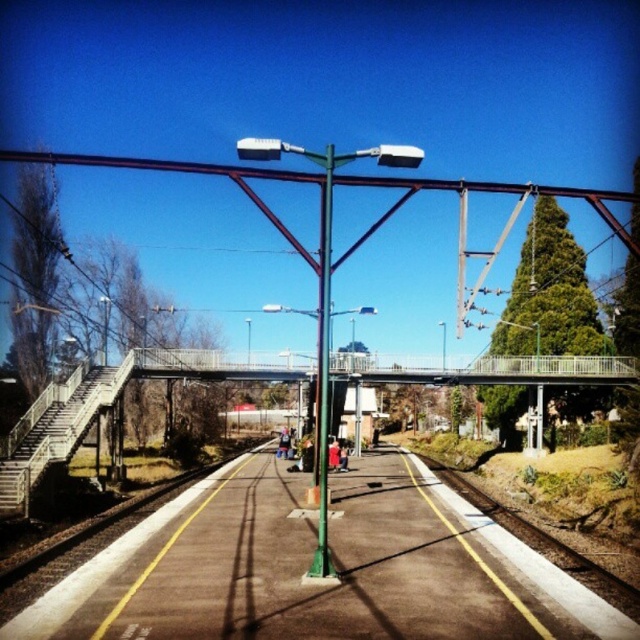
Who is more distant from viewer, (340, 365) or (320, 448)?

The point (340, 365) is behind.

Where is `metallic gray bridge at center`? This screenshot has width=640, height=640. metallic gray bridge at center is located at coordinates (499, 371).

Is metallic gray bridge at center wider than silver metallic train at center?

Correct, the width of metallic gray bridge at center exceeds that of silver metallic train at center.

Is point (150, 358) in front of point (282, 426)?

Yes, point (150, 358) is in front of point (282, 426).

Who is more distant from viewer, [368,380] or [266,424]?

The point [266,424] is behind.

This screenshot has width=640, height=640. In order to click on metallic gray bridge at center in this screenshot , I will do `click(499, 371)`.

Is green metallic pole at center smaller than silver metallic train at center?

Incorrect, green metallic pole at center is not smaller in size than silver metallic train at center.

Between point (314, 156) and point (282, 410), which one is positioned behind?

Positioned behind is point (282, 410).

Which is behind, point (321, 284) or point (268, 412)?

Point (268, 412)

The width and height of the screenshot is (640, 640). What are the coordinates of `green metallic pole at center` in the screenshot? It's located at (323, 368).